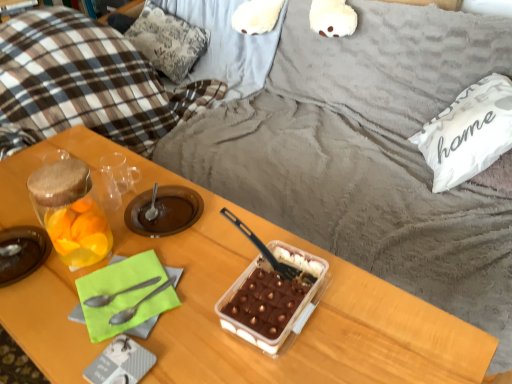
Identify the location of vacant area that lies to the right of silver metallic spoon at center, acting as the 2th spoon starting from the right. The width and height of the screenshot is (512, 384). (215, 299).